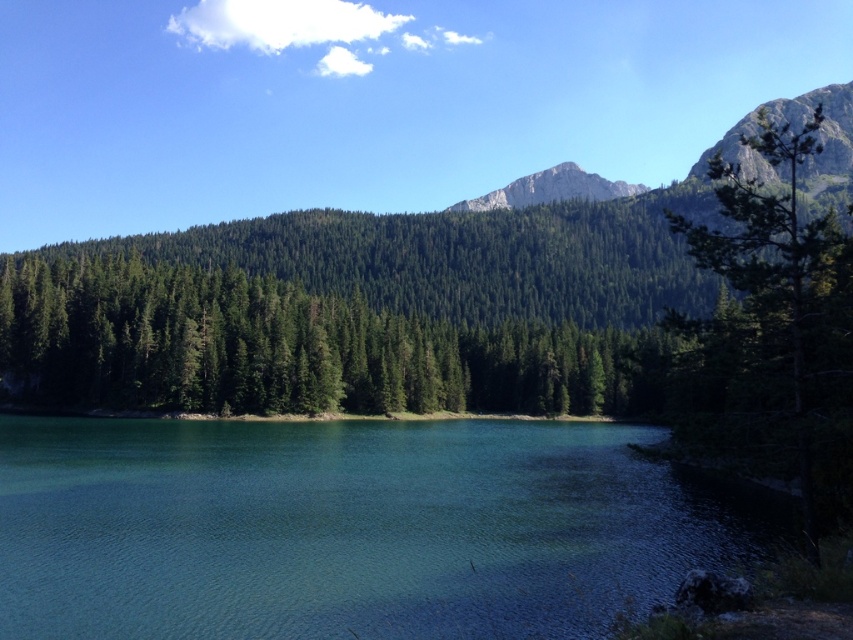
Question: Which object is positioned closest to the rugged stone mountain at upper right?

Choices:
 (A) green matte tree at center
 (B) clear glassy water at center

Answer: (A)

Question: Based on their relative distances, which object is nearer to the clear glassy water at center?

Choices:
 (A) green matte tree at center
 (B) rugged stone mountain at upper right
 (C) rugged granite mountain at upper center

Answer: (A)

Question: Can you confirm if green matte tree at center is thinner than rugged stone mountain at upper right?

Choices:
 (A) no
 (B) yes

Answer: (A)

Question: Which object is the farthest from the rugged granite mountain at upper center?

Choices:
 (A) rugged stone mountain at upper right
 (B) green matte tree at center

Answer: (B)

Question: Is rugged stone mountain at upper right closer to camera compared to rugged granite mountain at upper center?

Choices:
 (A) no
 (B) yes

Answer: (B)

Question: From the image, what is the correct spatial relationship of clear glassy water at center in relation to rugged granite mountain at upper center?

Choices:
 (A) left
 (B) right

Answer: (A)